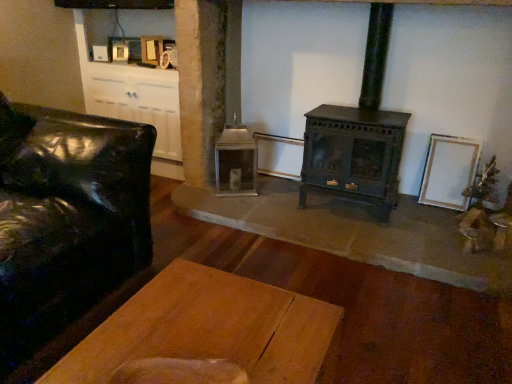
Question: Based on their positions, is wooden plank table at center located to the left or right of green matte wood burning stove at center?

Choices:
 (A) left
 (B) right

Answer: (A)

Question: Considering their positions, is wooden plank table at center located in front of or behind green matte wood burning stove at center?

Choices:
 (A) behind
 (B) front

Answer: (B)

Question: Which is nearer to the green matte wood burning stove at center?

Choices:
 (A) white matte picture frame at right
 (B) wooden plank table at center
 (C) black leather couch at left

Answer: (A)

Question: Estimate the real-world distances between objects in this image. Which object is farther from the white matte picture frame at right?

Choices:
 (A) black leather couch at left
 (B) wooden plank table at center
 (C) green matte wood burning stove at center

Answer: (A)